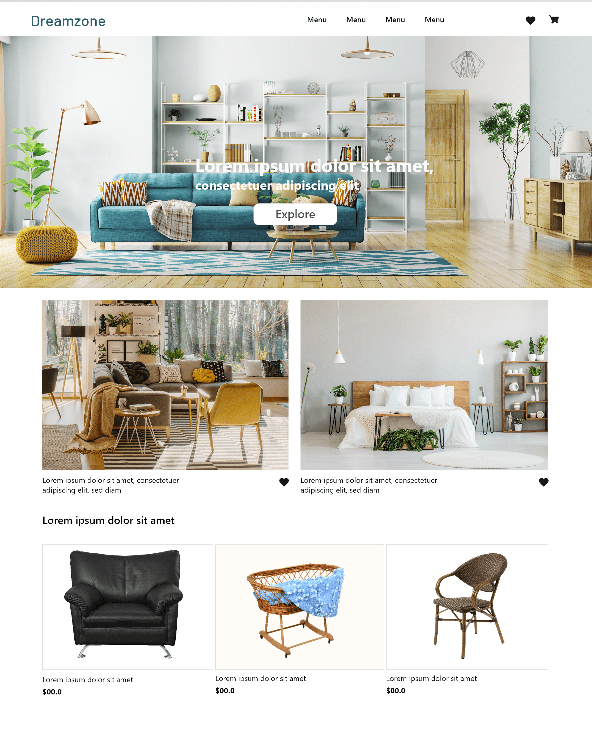
The height and width of the screenshot is (750, 592). Identify the location of blanket. (323, 604), (93, 398), (360, 418), (173, 219).